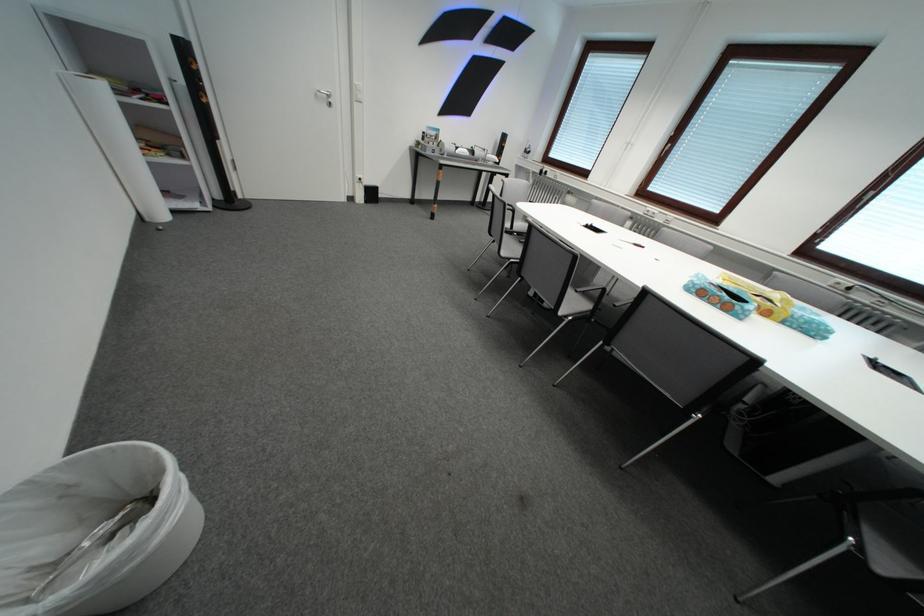
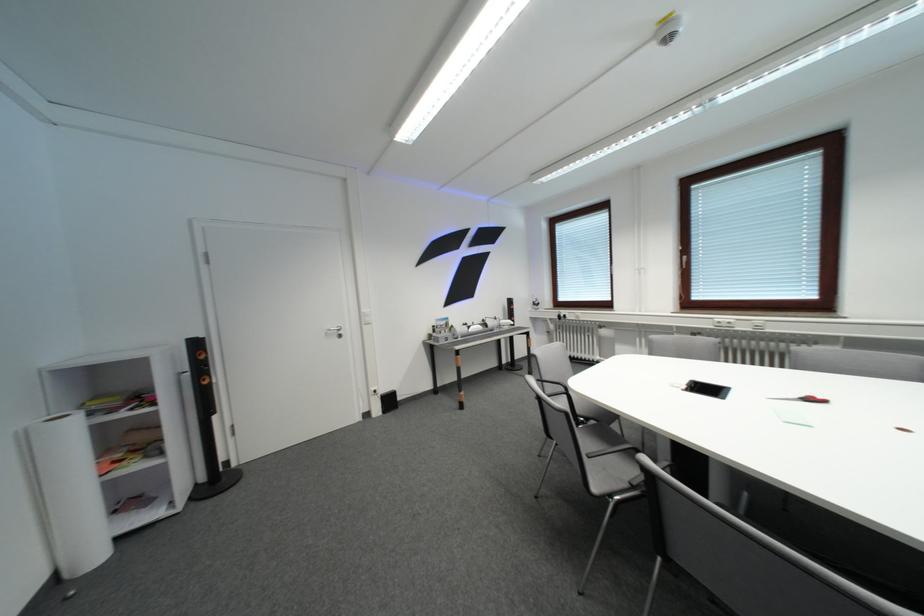
Question: The first image is from the beginning of the video and the second image is from the end. How did the camera likely rotate when shooting the video?

Choices:
 (A) Left
 (B) Right
 (C) Up
 (D) Down

Answer: (C)